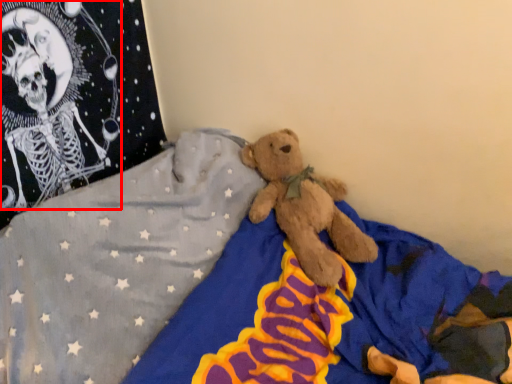
Question: From the image, what is the correct spatial relationship of toy (annotated by the red box) in relation to bed?

Choices:
 (A) left
 (B) right

Answer: (A)